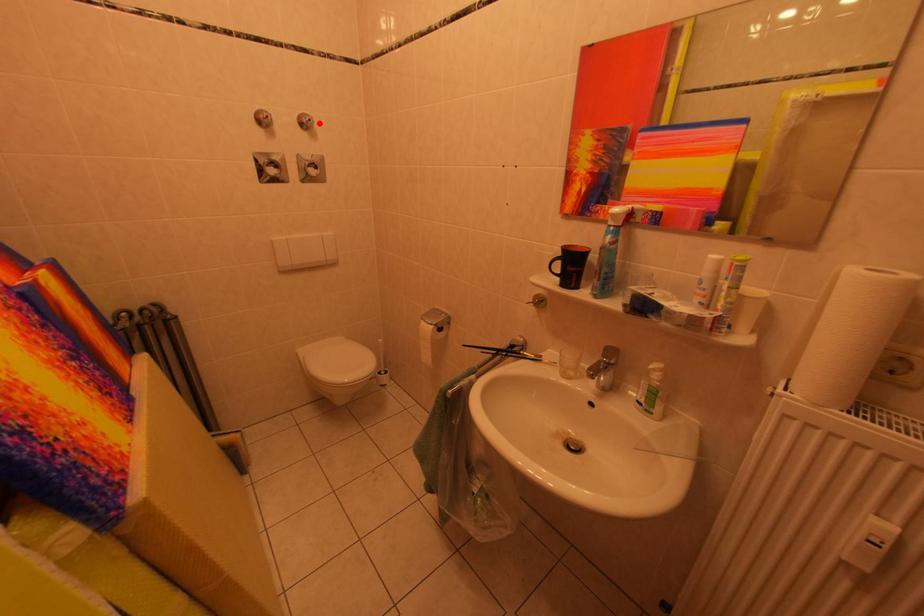
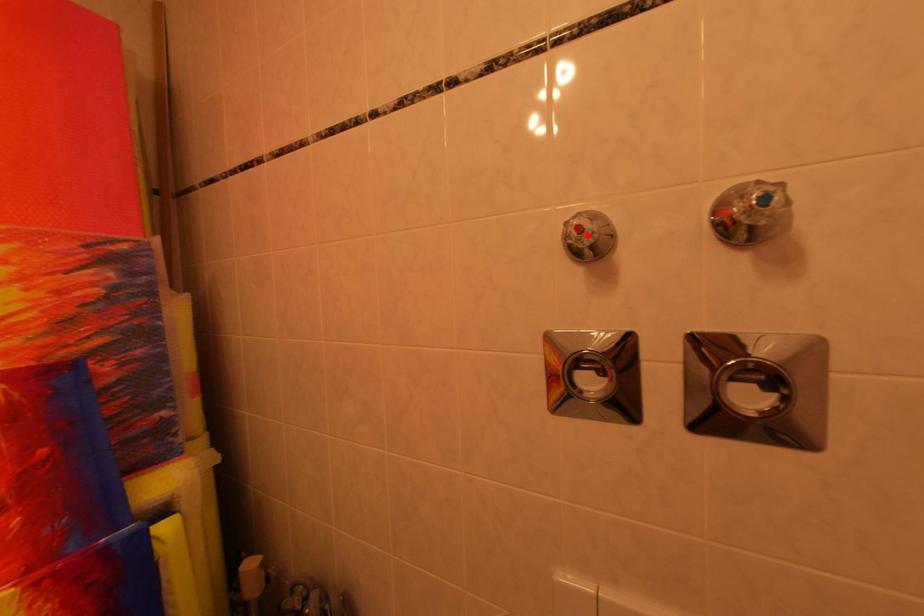
I am providing you with two images of the same scene from different viewpoints. A red point is marked on the first image and another point is marked on the second image. Is the marked point in image1 the same physical position as the marked point in image2?

No